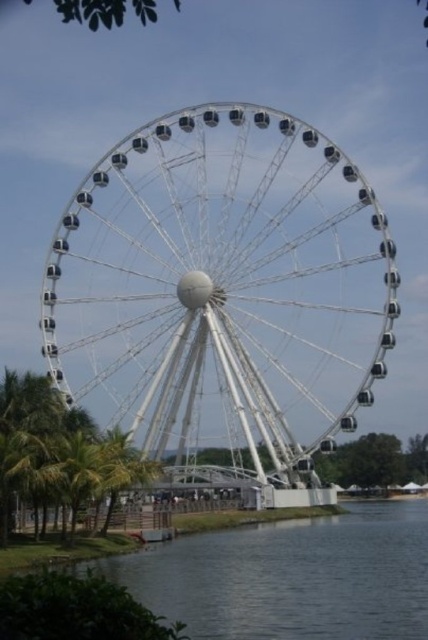
Question: Can you confirm if white metallic ferris wheel at center is positioned above green leafy tree at lower left?

Choices:
 (A) yes
 (B) no

Answer: (A)

Question: Estimate the real-world distances between objects in this image. Which object is closer to the green leafy tree at lower left?

Choices:
 (A) green leafy palm tree at lower left
 (B) white metallic ferris wheel at center

Answer: (A)

Question: Which is nearer to the green leafy palm tree at lower left?

Choices:
 (A) white metallic ferris wheel at center
 (B) green leafy tree at lower left

Answer: (B)

Question: Which object appears closest to the camera in this image?

Choices:
 (A) green leafy palm tree at lower left
 (B) white metallic ferris wheel at center

Answer: (A)

Question: Can you confirm if white metallic ferris wheel at center is positioned to the right of green leafy palm tree at lower left?

Choices:
 (A) yes
 (B) no

Answer: (A)

Question: Does white metallic ferris wheel at center come in front of green leafy palm tree at lower left?

Choices:
 (A) yes
 (B) no

Answer: (B)